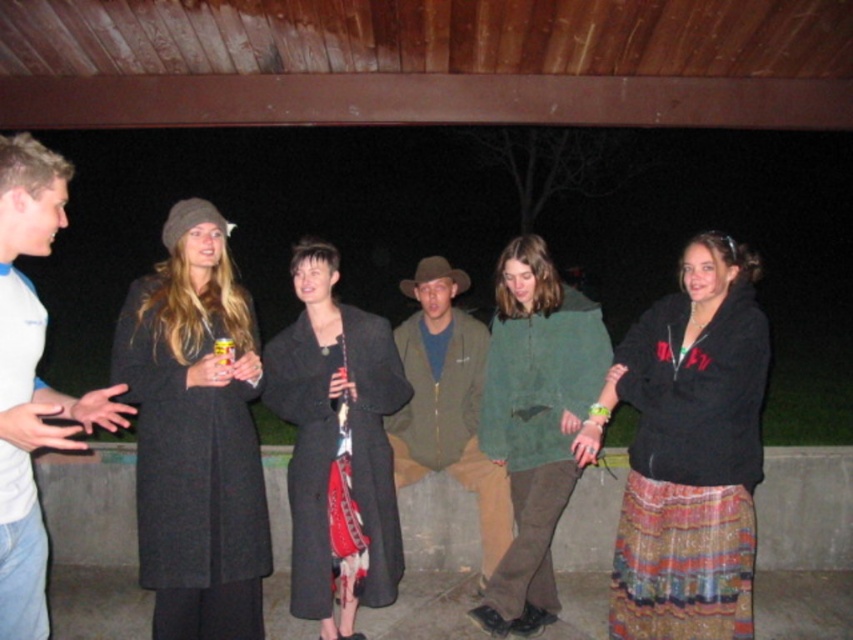
Which is above, dark gray wool coat at left or green matte jacket at center?

dark gray wool coat at left is above.

Is dark gray wool coat at left smaller than green matte jacket at center?

Yes.

Does point (189, 260) lie behind point (427, 442)?

That is False.

Where is `dark gray wool coat at left`? This screenshot has width=853, height=640. dark gray wool coat at left is located at coordinates (195, 433).

How much distance is there between black textured hoodie at center and matte black coat at center?

A distance of 3.36 feet exists between black textured hoodie at center and matte black coat at center.

Which of these two, black textured hoodie at center or matte black coat at center, stands taller?

With more height is matte black coat at center.

What do you see at coordinates (689, 451) in the screenshot?
I see `black textured hoodie at center` at bounding box center [689, 451].

Locate an element on the screen. The image size is (853, 640). black textured hoodie at center is located at coordinates (689, 451).

Does dark gray wool coat at left have a lesser height compared to matte black coat at center?

Correct, dark gray wool coat at left is not as tall as matte black coat at center.

Which is in front, point (218, 264) or point (265, 397)?

Positioned in front is point (218, 264).

The image size is (853, 640). In order to click on dark gray wool coat at left in this screenshot , I will do [x=195, y=433].